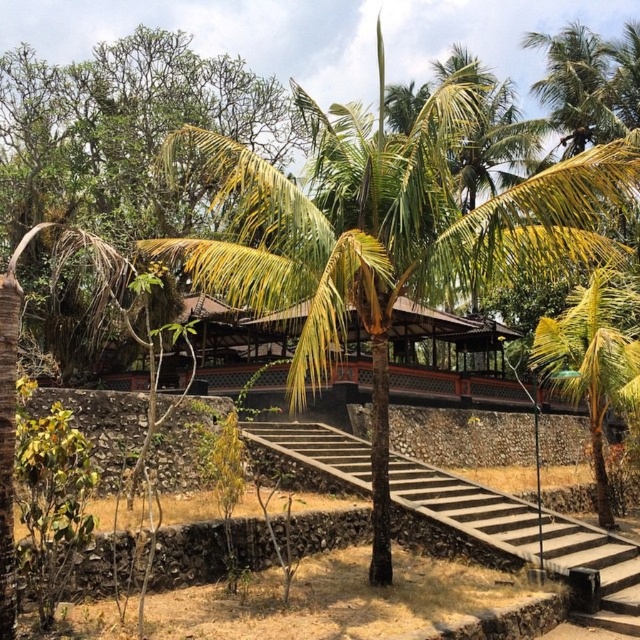
You are standing at the base of the concrete steps leading to the pavilion and want to reach the point marked as point [308,436]. However, there is an obstacle at point [497,244]. Will you need to go around the obstacle to reach your destination?

Point [497,244] is in front of point [308,436], so you will need to go around the obstacle at point [497,244] to reach your destination point [308,436].

You are standing at the base of the concrete steps leading up to the pavilion. Looking towards the pavilion, where is the green leafy palm tree at center located in relation to your position?

The green leafy palm tree at center is located at point 0.369 on the x axis and 0.606 on the y axis relative to your position at the base of the steps.

You are standing at the entrance of the pavilion and want to go down to the sandy ground below. Which direction should you head relative to the brown wooden stairs at center?

You should head downward from the brown wooden stairs at center to reach the sandy ground below since the stairs are located at a higher elevation compared to the ground level.